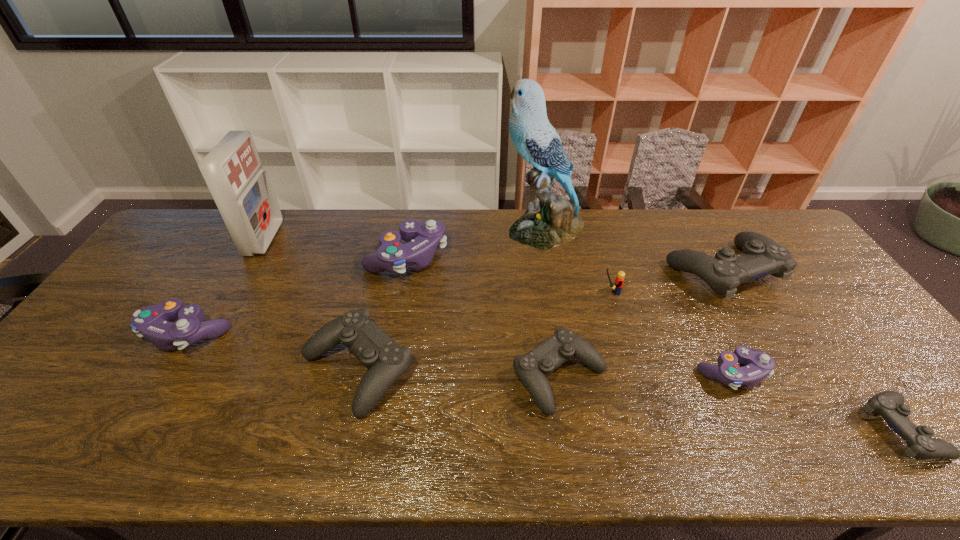
Where is `vacant space at the far edge of the desktop`? Image resolution: width=960 pixels, height=540 pixels. vacant space at the far edge of the desktop is located at coordinates (297, 208).

Identify the location of blank space at the near edge of the desktop. This screenshot has height=540, width=960. (771, 435).

This screenshot has width=960, height=540. I want to click on vacant space at the left edge of the desktop, so click(76, 346).

I want to click on vacant space at the right edge of the desktop, so click(851, 312).

Where is `vacant area that lies between the red first-aid kit and the second biggest purple control`? The width and height of the screenshot is (960, 540). vacant area that lies between the red first-aid kit and the second biggest purple control is located at coordinates (227, 286).

Identify the location of vacant space that's between the smallest purple control and the biggest gray control. This screenshot has width=960, height=540. (727, 322).

Where is `vacant area that lies between the biggest purple control and the Lego`? vacant area that lies between the biggest purple control and the Lego is located at coordinates (508, 275).

The image size is (960, 540). Identify the location of free space between the first-aid kit and the leftmost control. (227, 286).

I want to click on free space that is in between the smallest purple control and the parakeet, so click(x=637, y=301).

Locate an element on the screen. Image resolution: width=960 pixels, height=540 pixels. empty space that is in between the Lego and the biggest gray control is located at coordinates (665, 282).